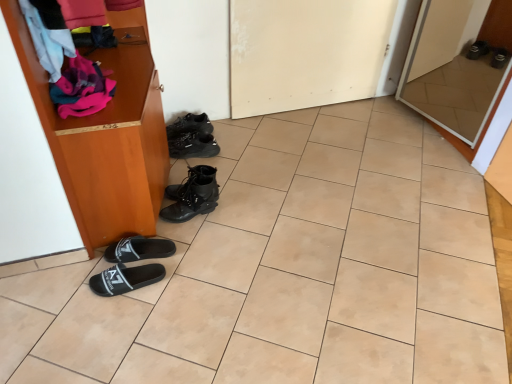
You are a GUI agent. You are given a task and a screenshot of the screen. Output one action in this format:
    pyautogui.click(x=<x>, y=<y>)
    Task: Click on the free space below black fabric slipper at lower left, the 1th footwear when ordered from bottom to top (from a real-world perspective)
    
    Given the screenshot: What is the action you would take?
    pyautogui.click(x=136, y=283)